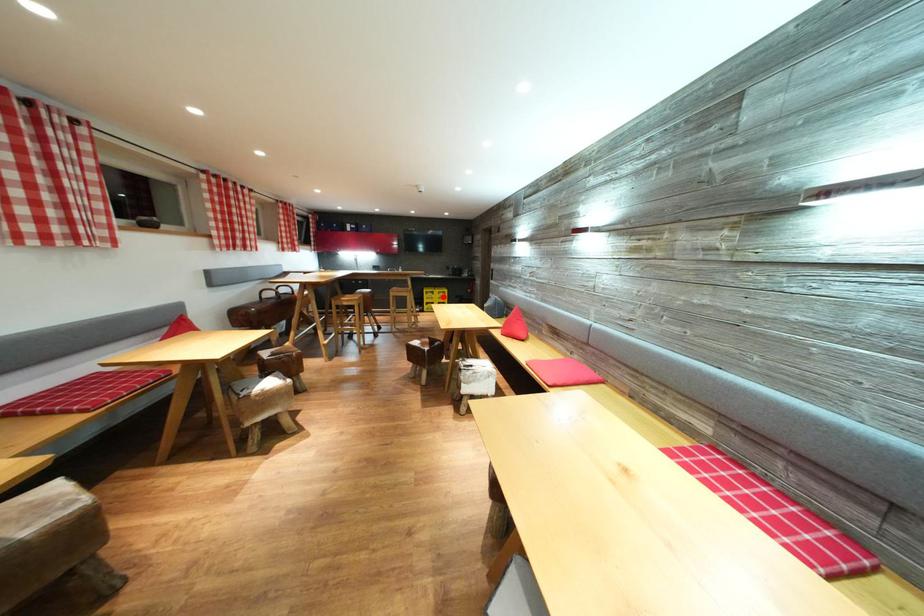
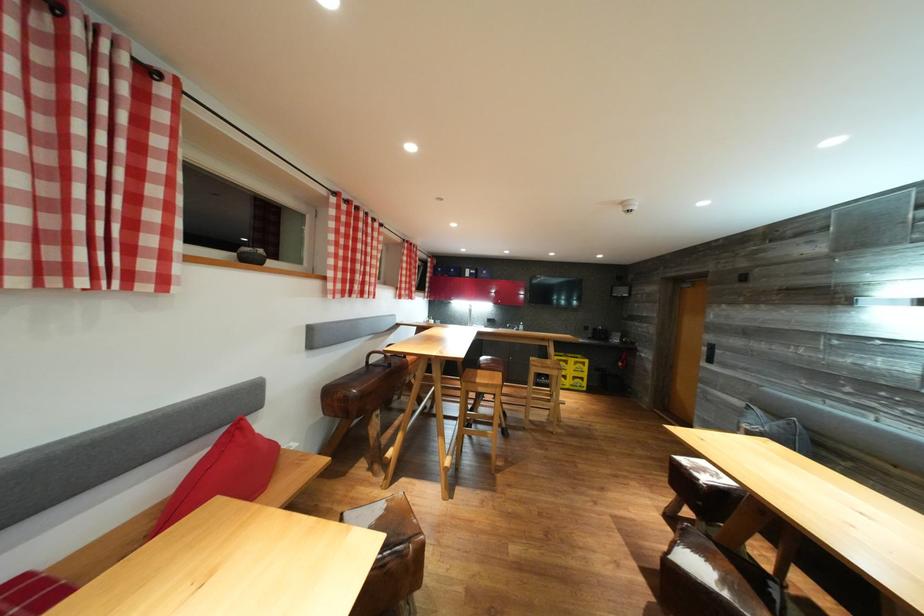
The point at the highlighted location is marked in the first image. Where is the corresponding point in the second image?

(578, 366)